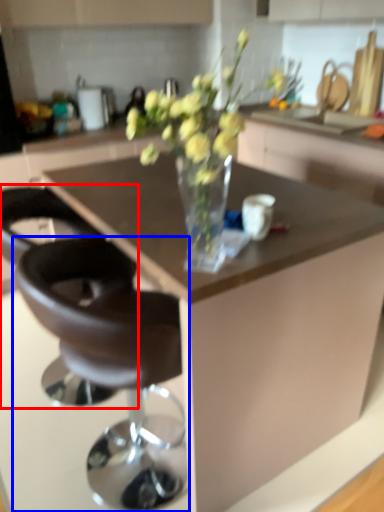
Question: Which point is closer to the camera, chair (highlighted by a red box) or chair (highlighted by a blue box)?

Choices:
 (A) chair
 (B) chair

Answer: (B)